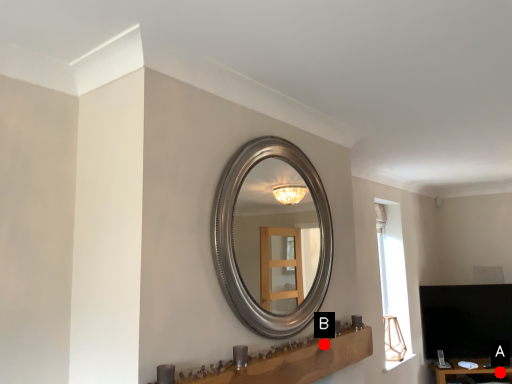
Question: Two points are circled on the image, labeled by A and B beside each circle. Which point is closer to the camera?

Choices:
 (A) A is closer
 (B) B is closer

Answer: (B)